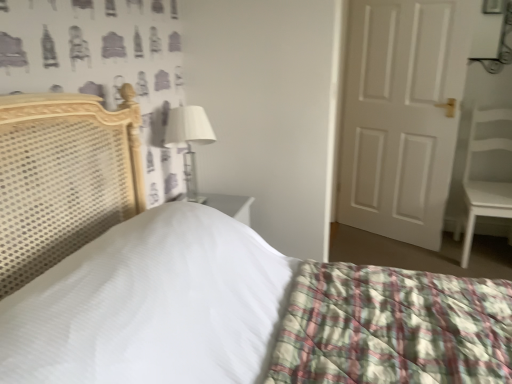
Question: Is white matte door at right oriented away from white fabric-covered lampshade at upper center?

Choices:
 (A) yes
 (B) no

Answer: (B)

Question: Considering the relative positions of white matte door at right and white fabric-covered lampshade at upper center in the image provided, is white matte door at right to the right of white fabric-covered lampshade at upper center from the viewer's perspective?

Choices:
 (A) yes
 (B) no

Answer: (A)

Question: Is white matte door at right taller than white fabric-covered lampshade at upper center?

Choices:
 (A) yes
 (B) no

Answer: (A)

Question: Considering the relative sizes of white matte door at right and white fabric-covered lampshade at upper center in the image provided, is white matte door at right smaller than white fabric-covered lampshade at upper center?

Choices:
 (A) yes
 (B) no

Answer: (B)

Question: Is white matte door at right completely or partially outside of white fabric-covered lampshade at upper center?

Choices:
 (A) yes
 (B) no

Answer: (A)

Question: From the image's perspective, is white matte door at right positioned above or below white matte chair at right?

Choices:
 (A) above
 (B) below

Answer: (A)

Question: Is point (444, 64) positioned closer to the camera than point (463, 236)?

Choices:
 (A) farther
 (B) closer

Answer: (B)

Question: Is white matte door at right situated inside white matte chair at right or outside?

Choices:
 (A) inside
 (B) outside

Answer: (B)

Question: In terms of width, does white matte door at right look wider or thinner when compared to white matte chair at right?

Choices:
 (A) wide
 (B) thin

Answer: (B)

Question: Visually, is white matte chair at right positioned to the left or to the right of white matte door at right?

Choices:
 (A) left
 (B) right

Answer: (B)

Question: From their relative heights in the image, would you say white matte chair at right is taller or shorter than white matte door at right?

Choices:
 (A) short
 (B) tall

Answer: (A)

Question: From the image's perspective, is white matte chair at right located above or below white matte door at right?

Choices:
 (A) below
 (B) above

Answer: (A)

Question: From a real-world perspective, is white matte chair at right above or below white matte door at right?

Choices:
 (A) above
 (B) below

Answer: (B)

Question: In terms of height, does white fabric-covered lampshade at upper center look taller or shorter compared to white matte door at right?

Choices:
 (A) tall
 (B) short

Answer: (B)

Question: From the image's perspective, is white fabric-covered lampshade at upper center above or below white matte door at right?

Choices:
 (A) below
 (B) above

Answer: (A)